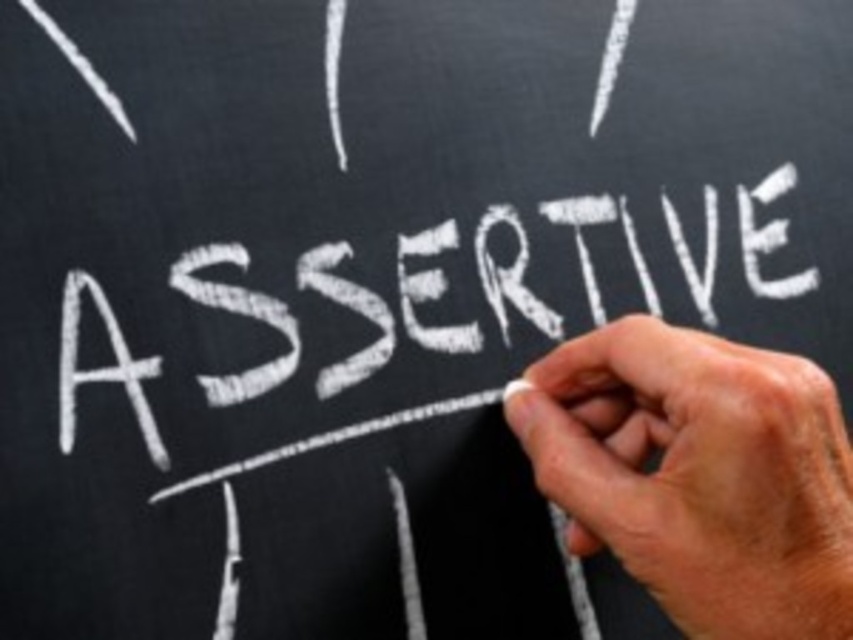
From the picture: You are standing in front of the blackboard and see two points marked on it. The first point is at coordinates point (695, 412) and the second point is at point (492, 285). Which point is closer to you?

Point (695, 412) is in front of point (492, 285), so the first point is closer to you.

You are a student who needs to write on the blackboard. You see the dry chalk at center. Where exactly should you place your hand to pick it up?

You should place your hand at the coordinates point (698, 474) to pick up the dry chalk at center.

You are a student trying to write on the blackboard. You have a dry chalk at center and a white chalk writing at center. Which object is thinner?

The dry chalk at center is thinner than the white chalk writing at center.